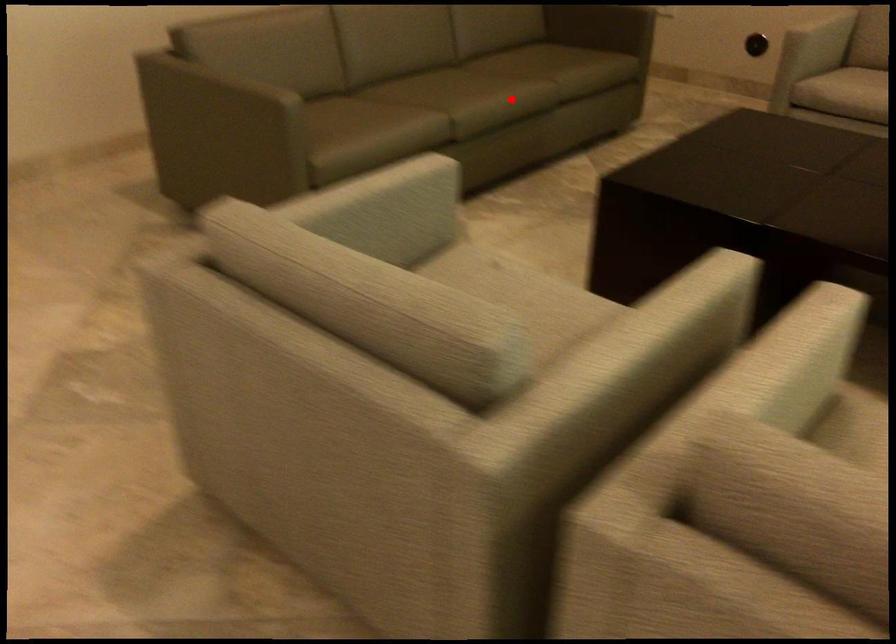
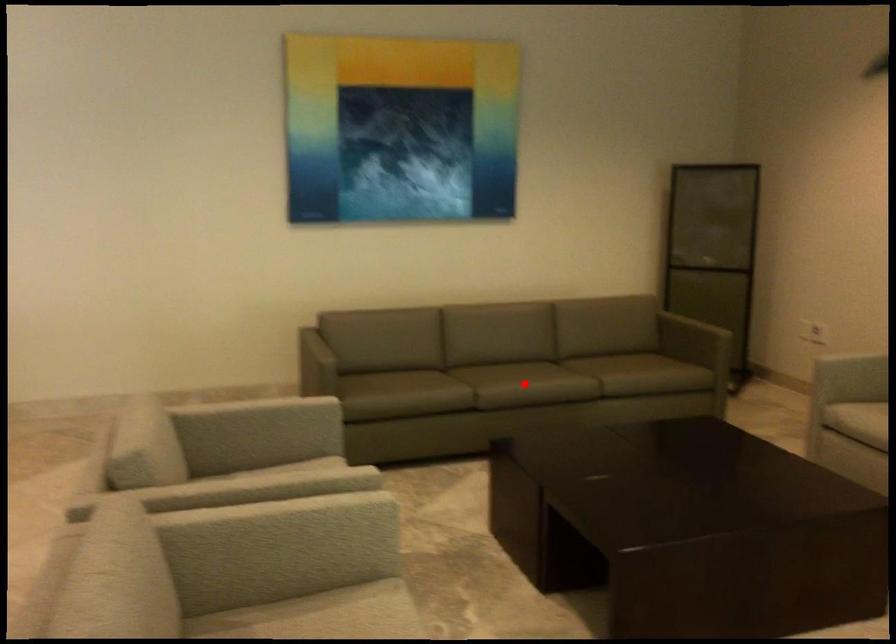
I am providing you with two images of the same scene from different viewpoints. A red point is marked on the first image and another point is marked on the second image. Is the red point in image1 aligned with the point shown in image2?

Yes